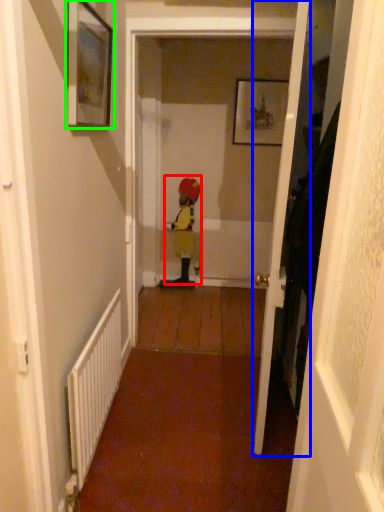
Question: Which is nearer to the person (highlighted by a red box)? door (highlighted by a blue box) or picture frame (highlighted by a green box).

Choices:
 (A) door
 (B) picture frame

Answer: (A)